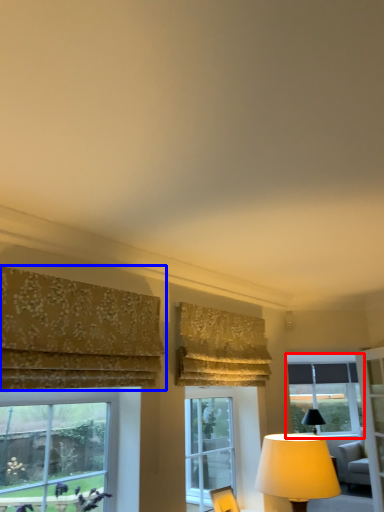
Question: Which point is further to the camera, window (highlighted by a red box) or curtain (highlighted by a blue box)?

Choices:
 (A) window
 (B) curtain

Answer: (A)